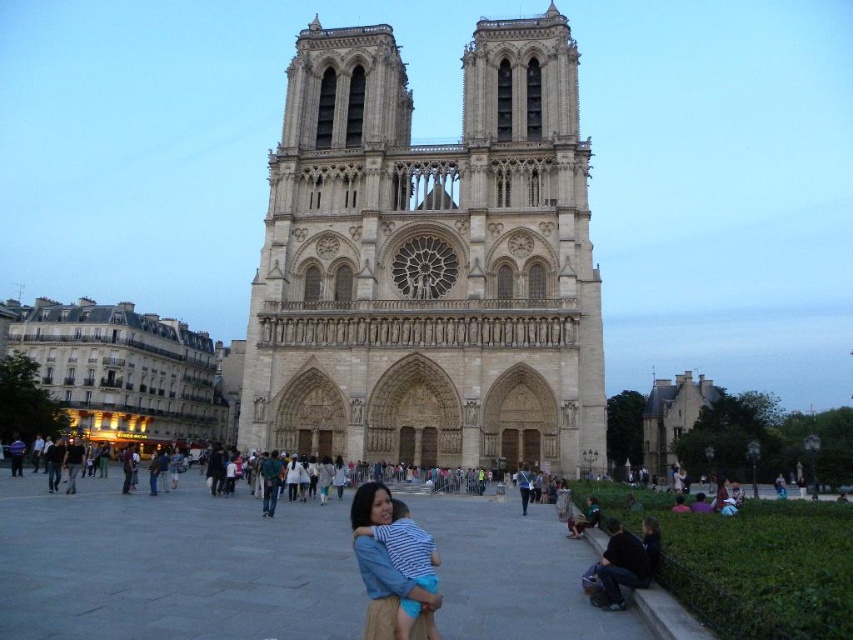
You are standing in the square in front of the cathedral. You want to take a photo of the beige stone cathedral at center without anyone blocking the view. The green fabric jacket at lower right is currently in the way. In which direction should you move to ensure the cathedral is fully visible?

You should move to the left side because the beige stone cathedral at center is to the left of the green fabric jacket at lower right. By moving left, you can position yourself so the cathedral is no longer blocked by the person in the green fabric jacket at lower right.

Consider the image. You are standing in the square in front of the beige stone cathedral at center and notice a green fabric jacket at lower right. Which object is wider?

The beige stone cathedral at center is wider than the green fabric jacket at lower right.

You are standing in front of the Notre Dame Cathedral and want to take a photo. You have two options for where to stand to capture the cathedral and the square. The first option is at point (259, 266) and the second option is at point (379, 545). Which point is closer to you?

Point (259, 266) is further to the viewer than point (379, 545), so the second point is closer to you.